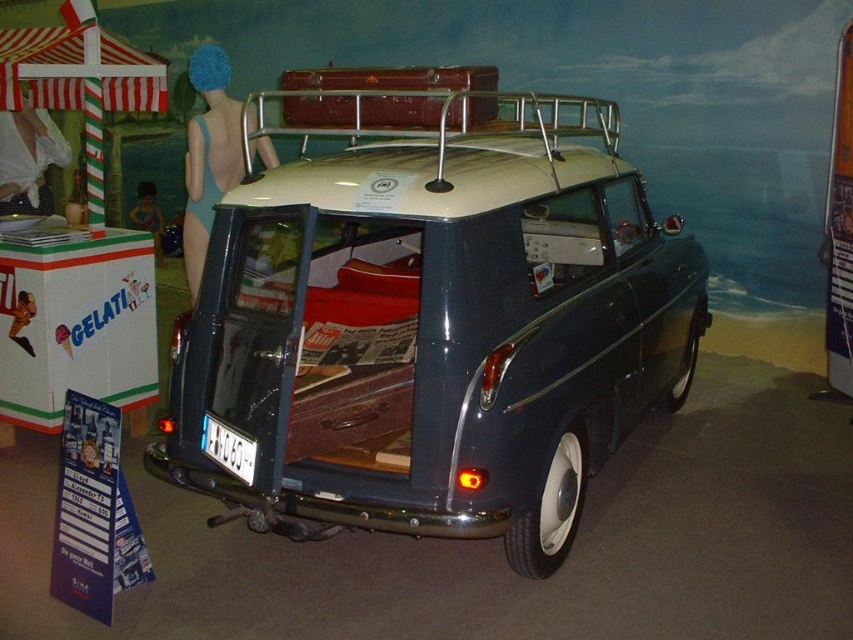
Which of these two, shiny dark blue van at center or blue swimsuit at left, stands shorter?

Standing shorter between the two is blue swimsuit at left.

Measure the distance between shiny dark blue van at center and blue swimsuit at left.

shiny dark blue van at center is 6.41 feet away from blue swimsuit at left.

This screenshot has width=853, height=640. Find the location of `shiny dark blue van at center`. shiny dark blue van at center is located at coordinates click(x=433, y=326).

Can you confirm if blue swimsuit at left is wider than blue fabric swimsuit at upper left?

Yes, blue swimsuit at left is wider than blue fabric swimsuit at upper left.

Is blue swimsuit at left shorter than blue fabric swimsuit at upper left?

In fact, blue swimsuit at left may be taller than blue fabric swimsuit at upper left.

Image resolution: width=853 pixels, height=640 pixels. Identify the location of blue swimsuit at left. (207, 154).

Which of these two, shiny dark blue van at center or blue fabric swimsuit at upper left, stands shorter?

With less height is blue fabric swimsuit at upper left.

Does point (364, 186) come closer to viewer compared to point (154, 186)?

Yes, it is in front of point (154, 186).

Locate an element on the screen. Image resolution: width=853 pixels, height=640 pixels. shiny dark blue van at center is located at coordinates (433, 326).